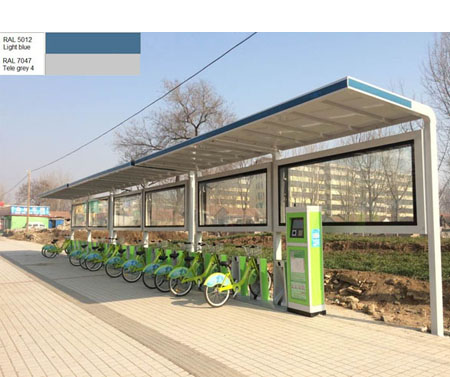
Where is `glass window`? glass window is located at coordinates (361, 198), (254, 205), (165, 211), (119, 217), (95, 218), (75, 217).